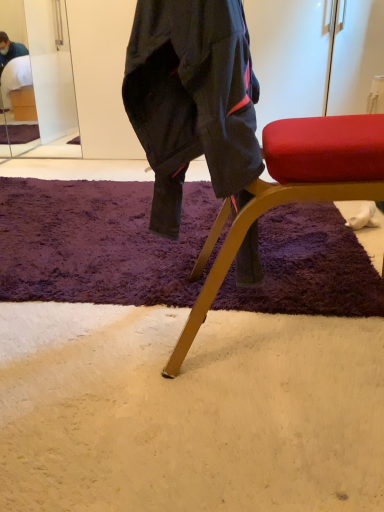
Question: Is metallic gold chair at center at the left side of purple shaggy rug at center?

Choices:
 (A) yes
 (B) no

Answer: (B)

Question: Considering the relative positions of metallic gold chair at center and purple shaggy rug at center in the image provided, is metallic gold chair at center behind purple shaggy rug at center?

Choices:
 (A) yes
 (B) no

Answer: (B)

Question: From a real-world perspective, is metallic gold chair at center physically above purple shaggy rug at center?

Choices:
 (A) no
 (B) yes

Answer: (B)

Question: Are metallic gold chair at center and purple shaggy rug at center located far from each other?

Choices:
 (A) yes
 (B) no

Answer: (B)

Question: Would you say purple shaggy rug at center is part of metallic gold chair at center's contents?

Choices:
 (A) yes
 (B) no

Answer: (B)

Question: Is clear glass mirror at upper left to the left or to the right of purple shaggy rug at center in the image?

Choices:
 (A) right
 (B) left

Answer: (B)

Question: Relative to purple shaggy rug at center, is clear glass mirror at upper left in front or behind?

Choices:
 (A) behind
 (B) front

Answer: (A)

Question: Looking at the image, does clear glass mirror at upper left seem bigger or smaller compared to purple shaggy rug at center?

Choices:
 (A) big
 (B) small

Answer: (B)

Question: Does point click(36, 84) appear closer or farther from the camera than point click(89, 242)?

Choices:
 (A) closer
 (B) farther

Answer: (B)

Question: Is clear glass mirror at upper left in front of or behind metallic gold chair at center in the image?

Choices:
 (A) behind
 (B) front

Answer: (A)

Question: Would you say clear glass mirror at upper left is inside or outside metallic gold chair at center?

Choices:
 (A) inside
 (B) outside

Answer: (B)

Question: Looking at the image, does clear glass mirror at upper left seem bigger or smaller compared to metallic gold chair at center?

Choices:
 (A) big
 (B) small

Answer: (B)

Question: From the image's perspective, is clear glass mirror at upper left positioned above or below metallic gold chair at center?

Choices:
 (A) below
 (B) above

Answer: (B)

Question: Is metallic gold chair at center inside the boundaries of clear glass mirror at upper left, or outside?

Choices:
 (A) inside
 (B) outside

Answer: (B)

Question: Considering the positions of metallic gold chair at center and clear glass mirror at upper left in the image, is metallic gold chair at center wider or thinner than clear glass mirror at upper left?

Choices:
 (A) wide
 (B) thin

Answer: (A)